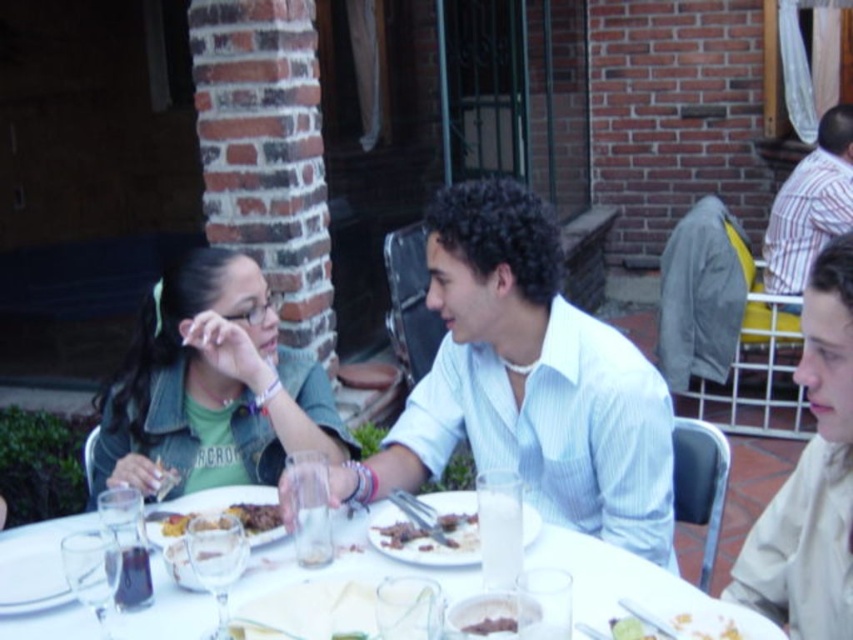
Question: In this image, where is white glossy table at center located relative to yellowish matte plate at lower right?

Choices:
 (A) right
 (B) left

Answer: (B)

Question: In this image, where is white striped shirt at center located relative to white glossy table at center?

Choices:
 (A) above
 (B) below

Answer: (A)

Question: Is white glossy table at center positioned at the back of golden brown meat at center?

Choices:
 (A) no
 (B) yes

Answer: (A)

Question: Considering the real-world distances, which object is farthest from the white glossy table at center?

Choices:
 (A) white striped shirt at center
 (B) denim jacket at upper left
 (C) green matte shirt at upper left
 (D) grilled meat at center

Answer: (C)

Question: Which of these objects is positioned closest to the brown crumbly bread at center?

Choices:
 (A) grilled meat at center
 (B) denim jacket at upper left

Answer: (A)

Question: Which is nearer to the golden brown meat at center?

Choices:
 (A) white striped shirt at center
 (B) striped cotton shirt at upper right
 (C) denim jacket at upper left

Answer: (C)